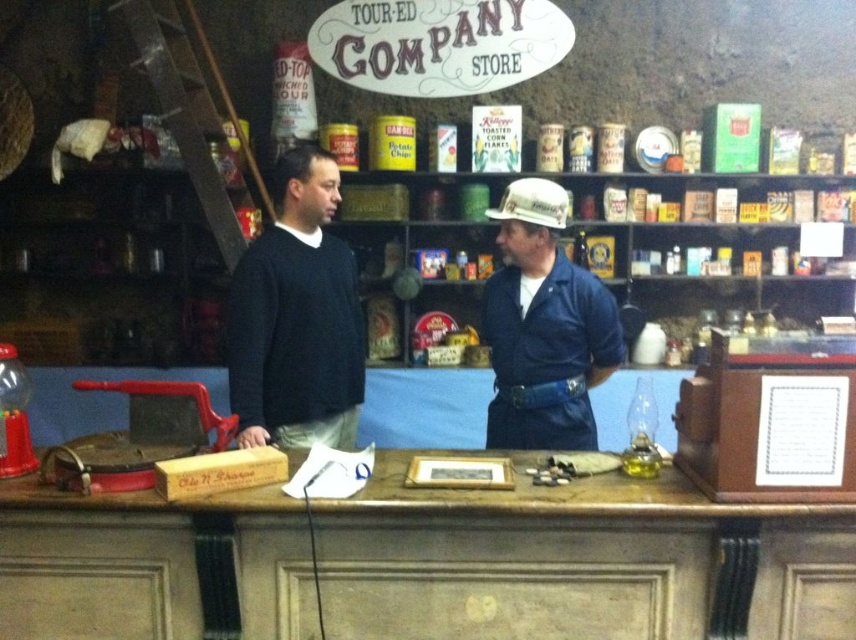
Does point (321, 252) lie behind point (492, 316)?

Yes.

Is dark blue sweater at center above blue denim shirt at center?

Indeed, dark blue sweater at center is positioned over blue denim shirt at center.

Measure the distance between point (253, 284) and camera.

They are 8.07 feet apart.

The height and width of the screenshot is (640, 856). What are the coordinates of `dark blue sweater at center` in the screenshot? It's located at (296, 317).